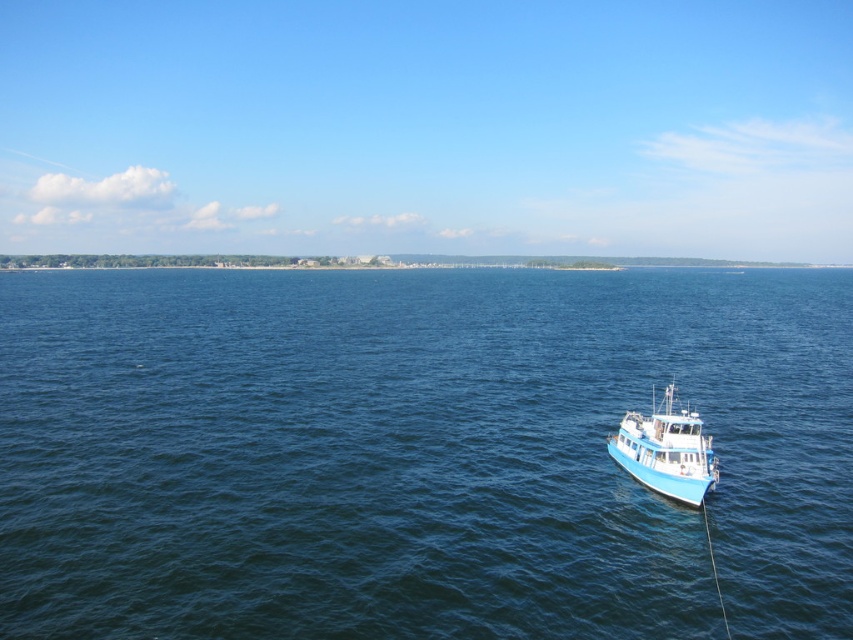
Question: Which point is closer to the camera?

Choices:
 (A) blue water at lower right
 (B) blue glossy boat at lower right

Answer: (A)

Question: Which of the following is the closest to the observer?

Choices:
 (A) (83, 413)
 (B) (654, 486)

Answer: (B)

Question: Does blue water at lower right lie behind blue glossy boat at lower right?

Choices:
 (A) no
 (B) yes

Answer: (A)

Question: Considering the relative positions of blue water at lower right and blue glossy boat at lower right in the image provided, where is blue water at lower right located with respect to blue glossy boat at lower right?

Choices:
 (A) above
 (B) below

Answer: (A)

Question: Where is blue water at lower right located in relation to blue glossy boat at lower right in the image?

Choices:
 (A) right
 (B) left

Answer: (A)

Question: Which point appears closest to the camera in this image?

Choices:
 (A) (335, 296)
 (B) (689, 416)

Answer: (B)